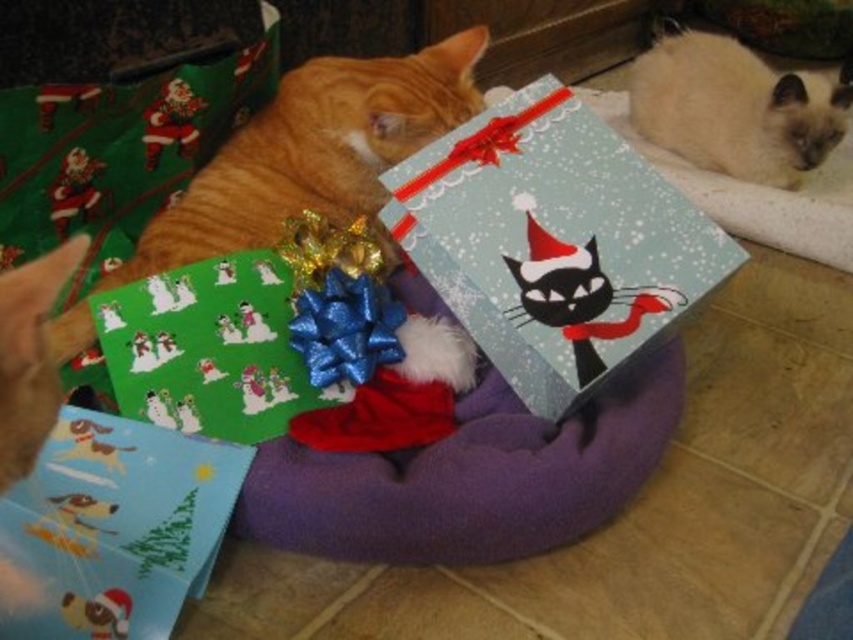
Question: Which object appears farthest from the camera in this image?

Choices:
 (A) matte blue paper at center
 (B) smokey white fur at upper right
 (C) orange fur cat at upper left
 (D) matte paper gift at lower left

Answer: (B)

Question: Estimate the real-world distances between objects in this image. Which object is closer to the orange fur cat at upper left?

Choices:
 (A) smokey white fur at upper right
 (B) matte paper gift at lower left

Answer: (B)

Question: Does matte blue paper at center have a lesser width compared to smokey white fur at upper right?

Choices:
 (A) no
 (B) yes

Answer: (A)

Question: Where is matte blue paper at center located in relation to orange fur cat at upper left in the image?

Choices:
 (A) below
 (B) above

Answer: (A)

Question: Considering the real-world distances, which object is farthest from the orange fur cat at upper left?

Choices:
 (A) smokey white fur at upper right
 (B) matte blue paper at center
 (C) matte paper gift at lower left

Answer: (A)

Question: Does matte paper gift at lower left have a greater width compared to smokey white fur at upper right?

Choices:
 (A) yes
 (B) no

Answer: (B)